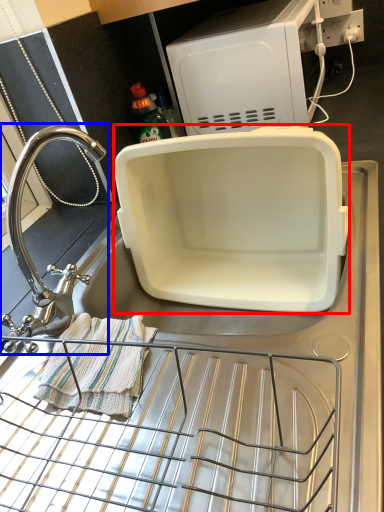
Question: Which point is further to the camera, appliance (highlighted by a red box) or tap (highlighted by a blue box)?

Choices:
 (A) appliance
 (B) tap

Answer: (A)